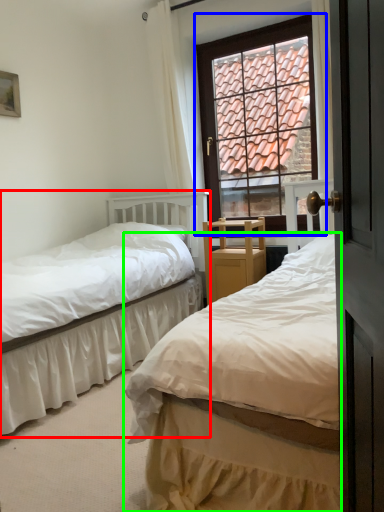
Question: Considering the real-world distances, which object is closest to bed (highlighted by a red box)? window (highlighted by a blue box) or bed (highlighted by a green box).

Choices:
 (A) window
 (B) bed

Answer: (A)